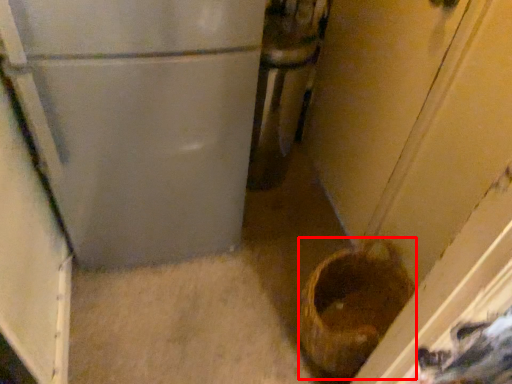
Question: From the image's perspective, where is basket container (annotated by the red box) located relative to appliance?

Choices:
 (A) above
 (B) below

Answer: (B)